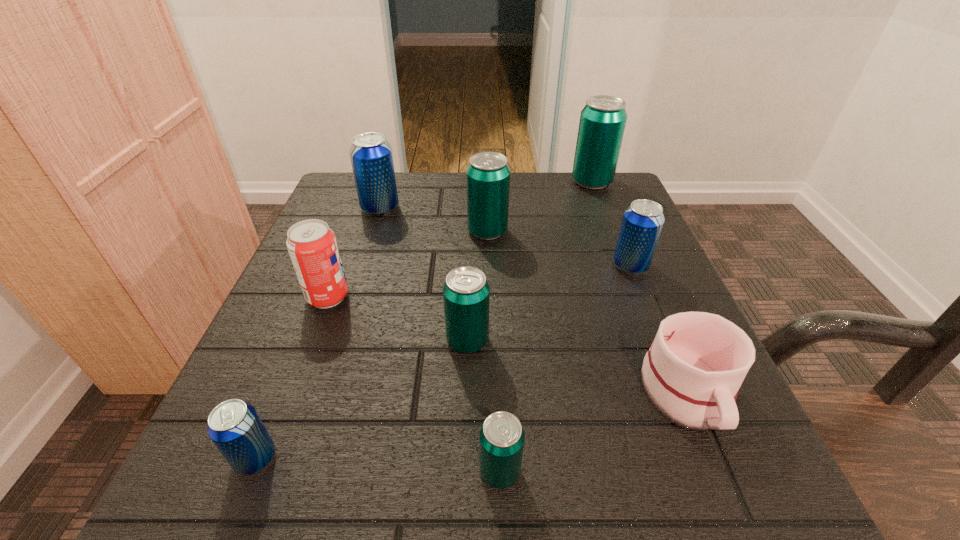
Find the location of a particular element. the second nearest teal beer can is located at coordinates (466, 293).

The width and height of the screenshot is (960, 540). Identify the location of white mug. (692, 373).

This screenshot has height=540, width=960. I want to click on the smallest blue beer can, so click(x=234, y=426).

You are a GUI agent. You are given a task and a screenshot of the screen. Output one action in this format:
    pyautogui.click(x=<x>, y=<y>)
    Task: Click on the smallest teal beer can
    
    Given the screenshot: What is the action you would take?
    pyautogui.click(x=501, y=439)

What are the coordinates of `vacant region located 0.090m on the front of the farthest beer can` in the screenshot? It's located at (604, 213).

The width and height of the screenshot is (960, 540). I want to click on vacant space located on the front of the second farthest beer can, so click(342, 330).

The width and height of the screenshot is (960, 540). Find the location of `free location located on the left of the seventh nearest object`. free location located on the left of the seventh nearest object is located at coordinates (382, 232).

The height and width of the screenshot is (540, 960). I want to click on vacant space situated 0.290m on the right of the soda can, so click(x=512, y=297).

Locate an element on the screen. free space located 0.320m on the back of the second farthest blue beer can is located at coordinates (594, 177).

This screenshot has height=540, width=960. I want to click on vacant space situated 0.320m on the right of the third farthest teal beer can, so click(688, 341).